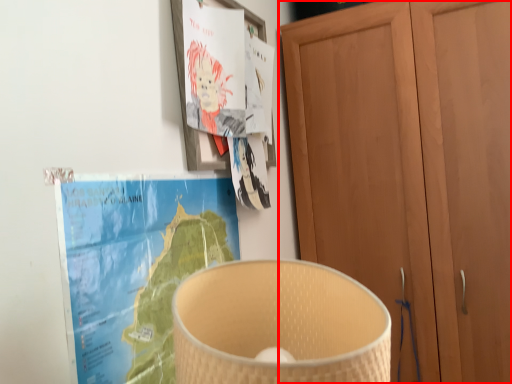
Question: From the image's perspective, where is cupboard (annotated by the red box) located in relation to paperback book in the image?

Choices:
 (A) below
 (B) above

Answer: (B)